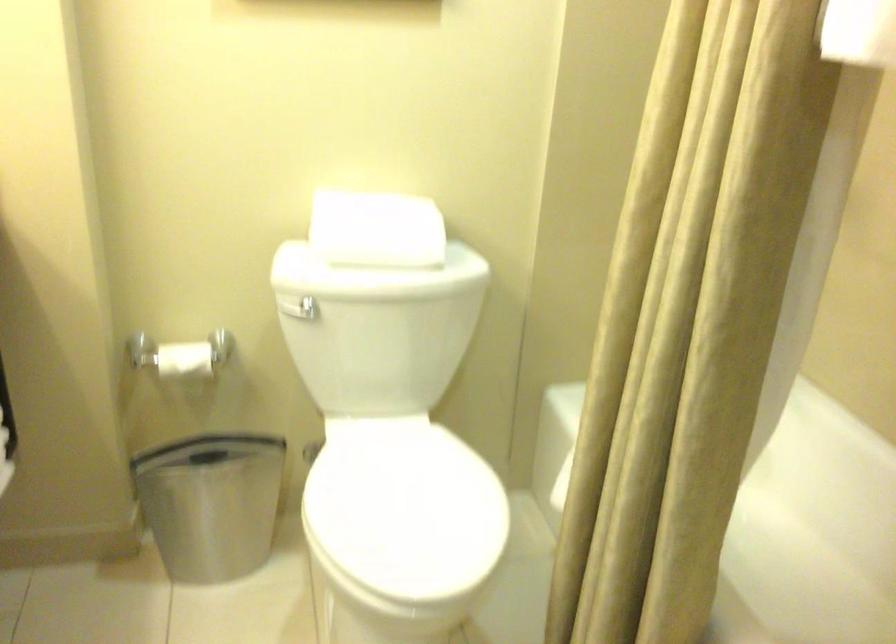
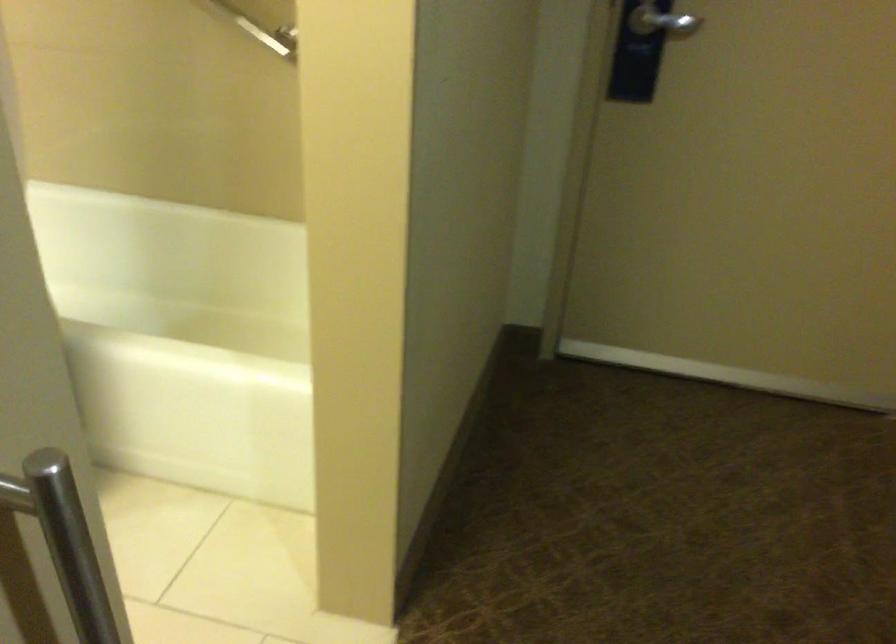
First-person continuous shooting, in which direction is the camera rotating?

The rotation direction of the camera is right-down.